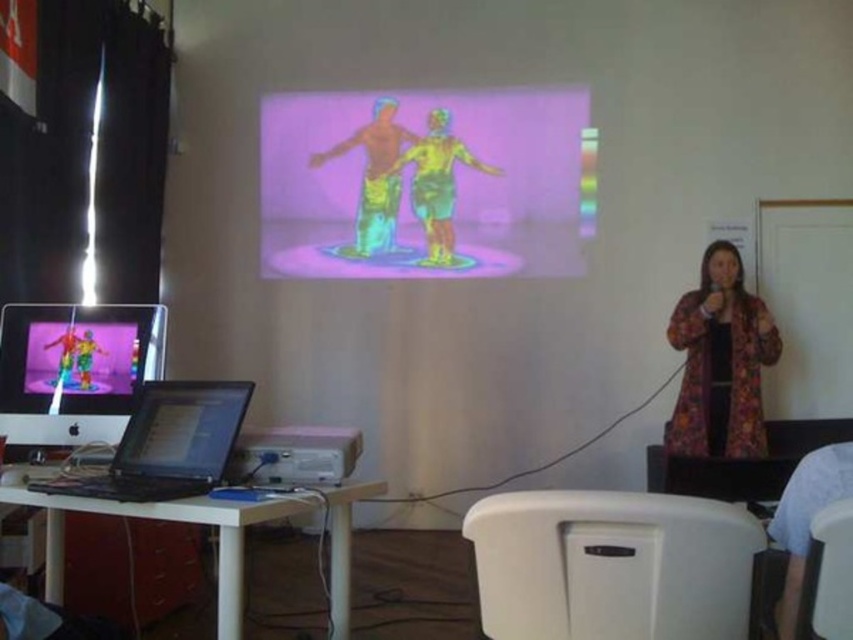
You are standing in front of the desk in the presentation room. You notice two points marked on the wall projection. The first point is at coordinates point (708, 356) and the second point is at point (177, 401). Which point is closer to you?

Point (177, 401) is closer to you because it is in front of point (708, 356).